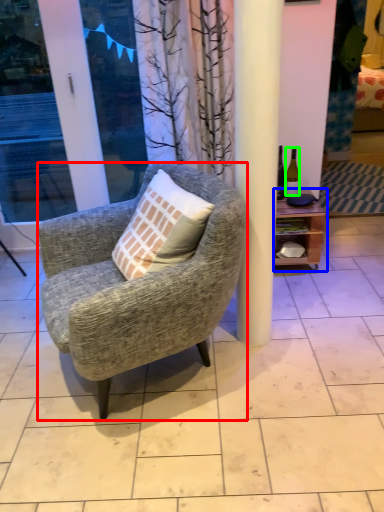
Question: Based on their relative distances, which object is nearer to chair (highlighted by a red box)? Choose from shelf (highlighted by a blue box) and bottle (highlighted by a green box).

Choices:
 (A) shelf
 (B) bottle

Answer: (A)